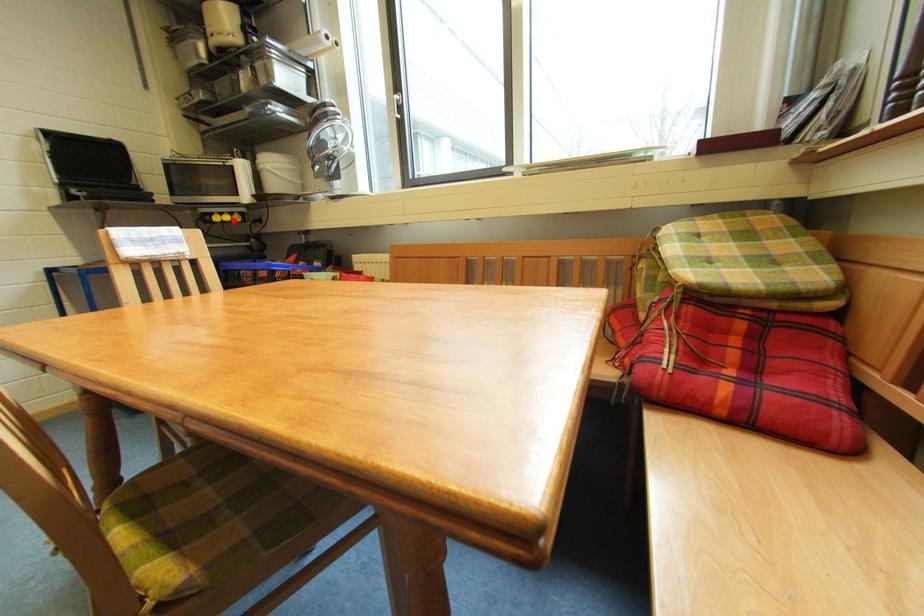
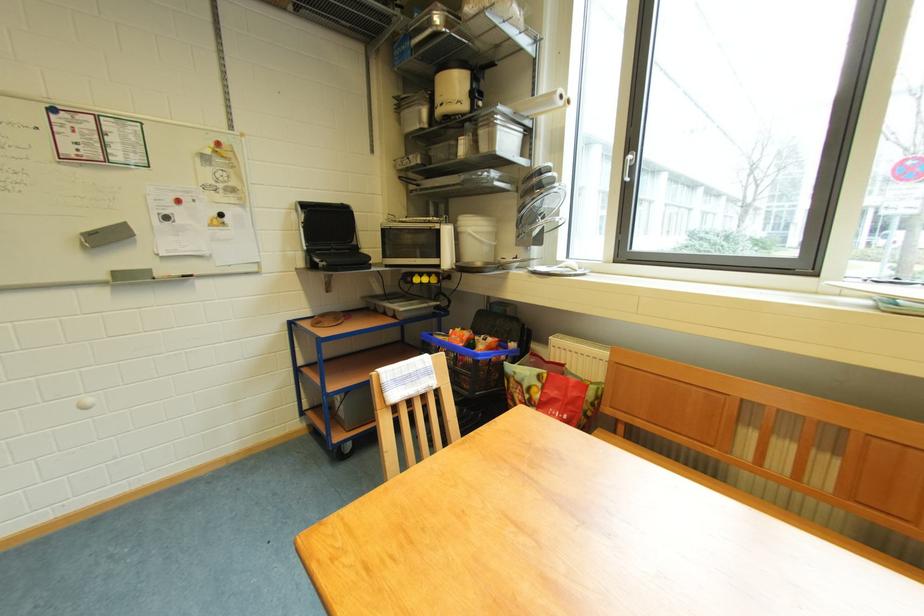
In the second image, find the point that corresponds to the highlighted location in the first image.

(432, 283)